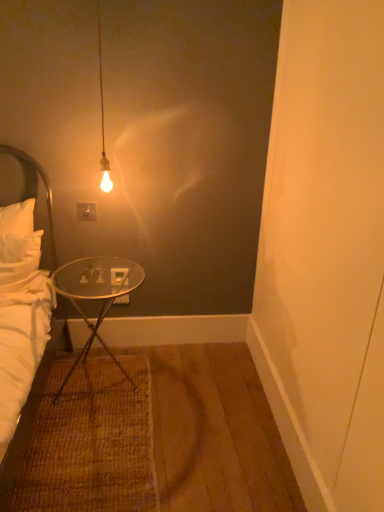
Where is `vacant area situated below transparent glass table at lower left (from a real-world perspective)`? vacant area situated below transparent glass table at lower left (from a real-world perspective) is located at coordinates (102, 380).